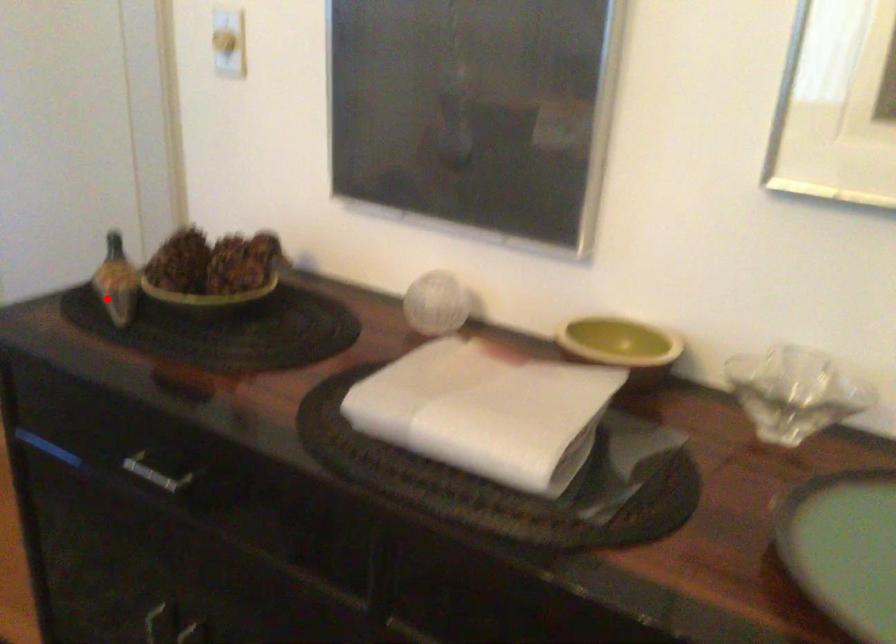
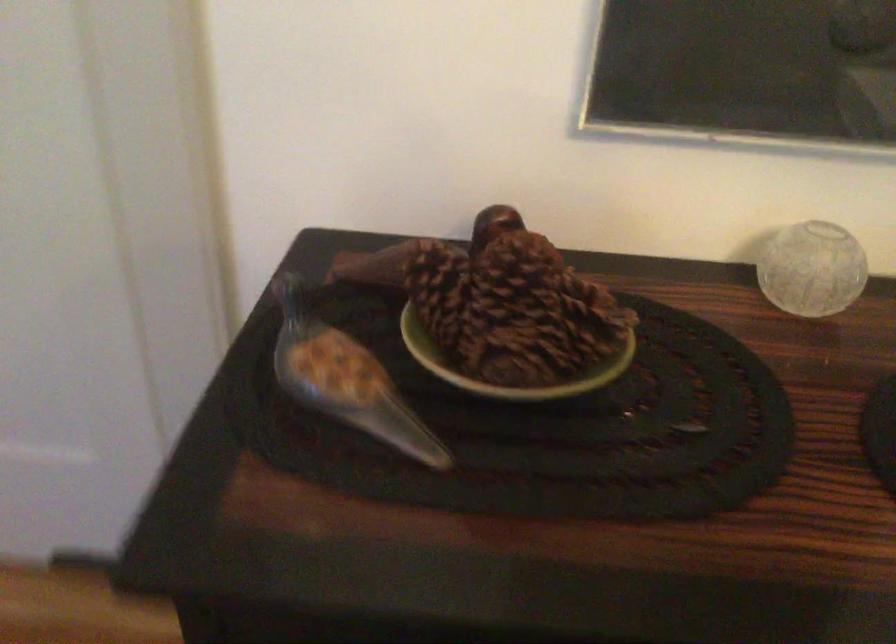
Where in the second image is the point corresponding to the highlighted location from the first image?

(347, 386)